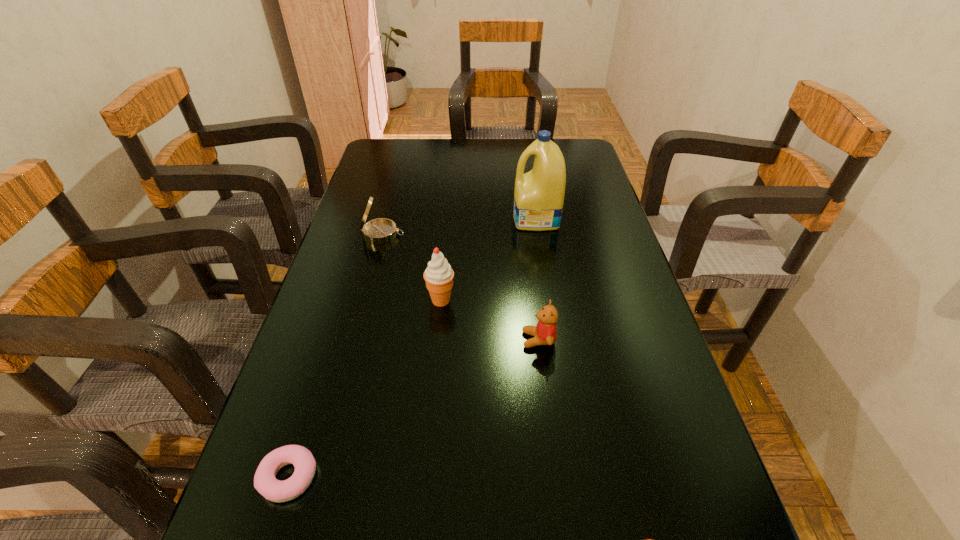
Where is `the tallest object`? The width and height of the screenshot is (960, 540). the tallest object is located at coordinates (539, 194).

At what (x,y) coordinates should I click in order to perform the action: click on the third object from left to right. Please return your answer as a coordinate pair (x, y). Looking at the image, I should click on (438, 275).

At what (x,y) coordinates should I click in order to perform the action: click on the fifth shortest object. Please return your answer as a coordinate pair (x, y). Looking at the image, I should click on (438, 275).

This screenshot has width=960, height=540. In order to click on the left compass in this screenshot , I will do `click(381, 230)`.

Identify the location of the taller compass. The image size is (960, 540). (381, 230).

At what (x,y) coordinates should I click in order to perform the action: click on teddy bear. Please return your answer as a coordinate pair (x, y). This screenshot has width=960, height=540. Looking at the image, I should click on (545, 332).

Where is `the second shortest object`? the second shortest object is located at coordinates (265, 483).

Where is `the fifth farthest object`? The width and height of the screenshot is (960, 540). the fifth farthest object is located at coordinates (265, 483).

Identify the location of free location located 0.180m on the label of the detergent. (451, 219).

Identify the location of vacant space located 0.060m on the label of the detergent. (492, 219).